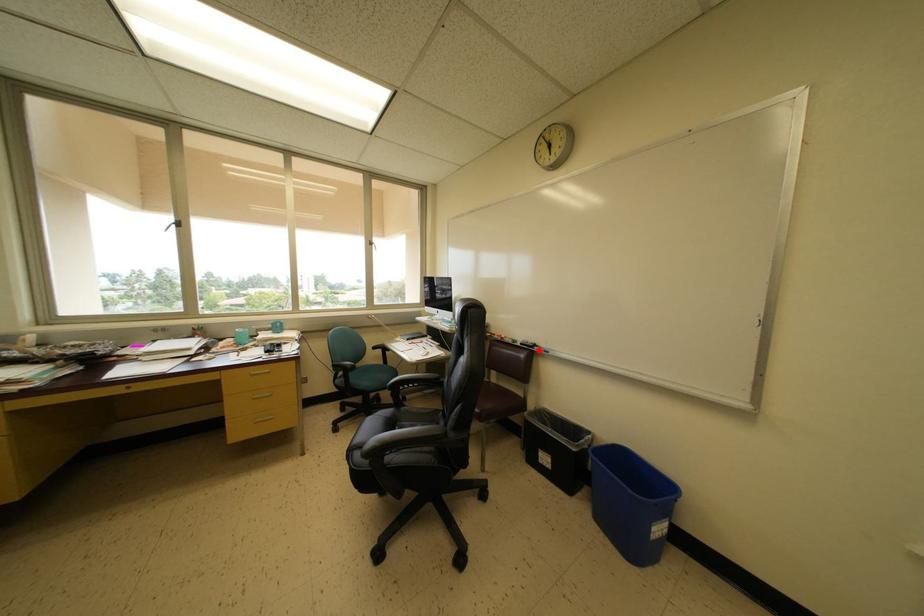
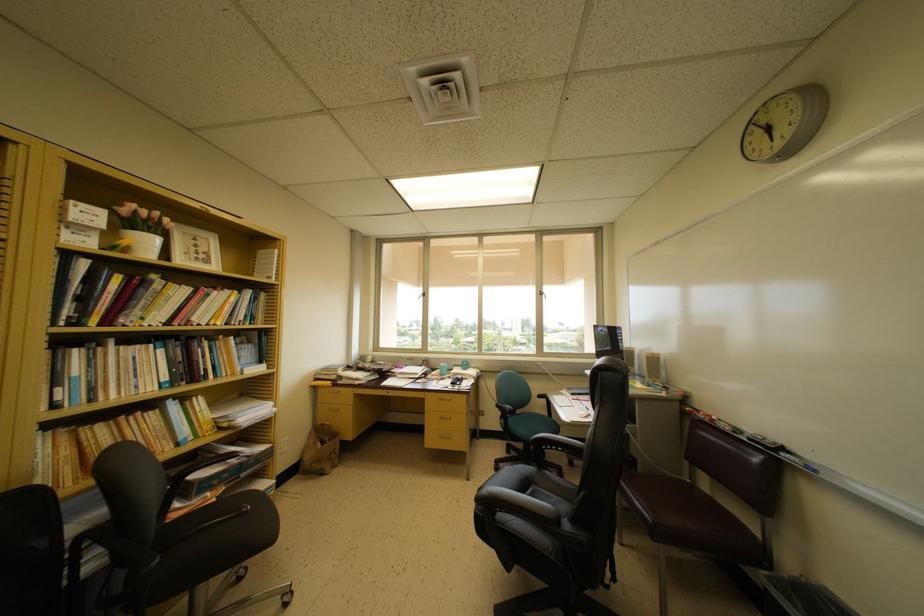
In the second image, find the point that corresponds to the highlighted location in the first image.

(786, 454)